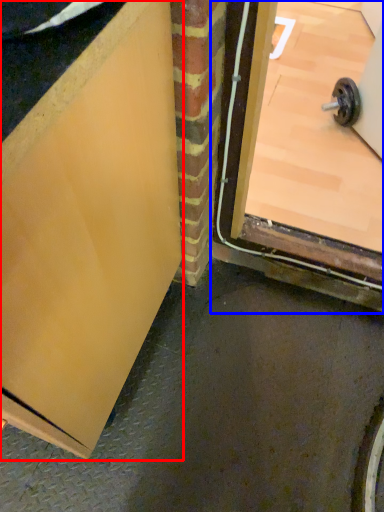
Question: Which object appears closest to the camera in this image, door (highlighted by a red box) or door (highlighted by a blue box)?

Choices:
 (A) door
 (B) door

Answer: (A)